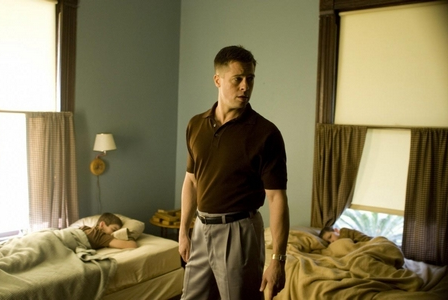
Where is `bed`? This screenshot has width=448, height=300. bed is located at coordinates (143, 266), (428, 275).